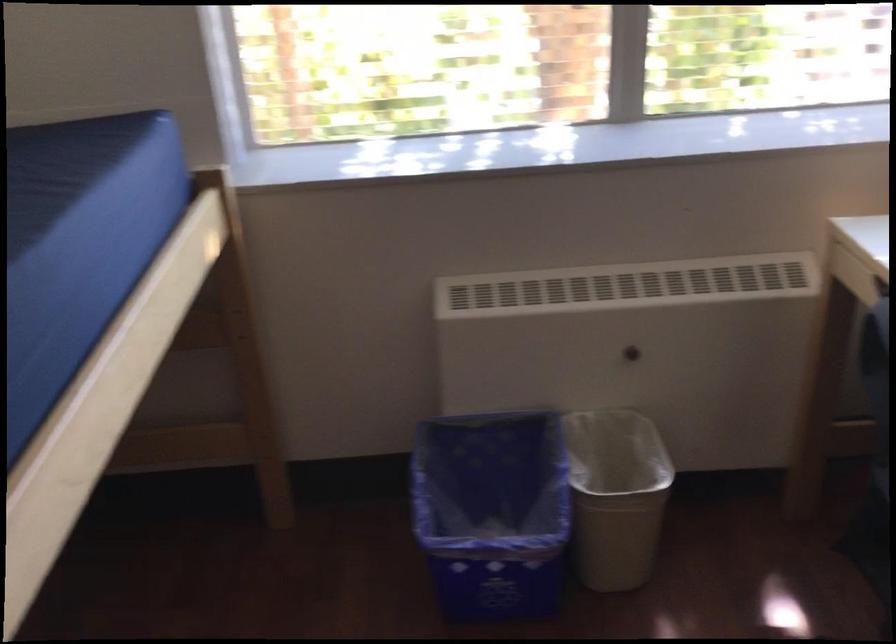
Find the location of a particular element. This screenshot has height=644, width=896. tan trash can is located at coordinates (616, 496).